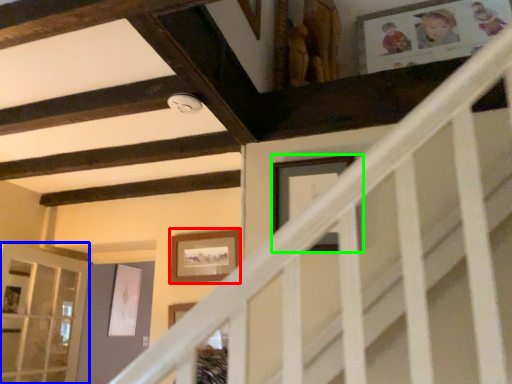
Question: Which is farther away from picture frame (highlighted by a red box)? glass door (highlighted by a blue box) or picture frame (highlighted by a green box)?

Choices:
 (A) glass door
 (B) picture frame

Answer: (A)